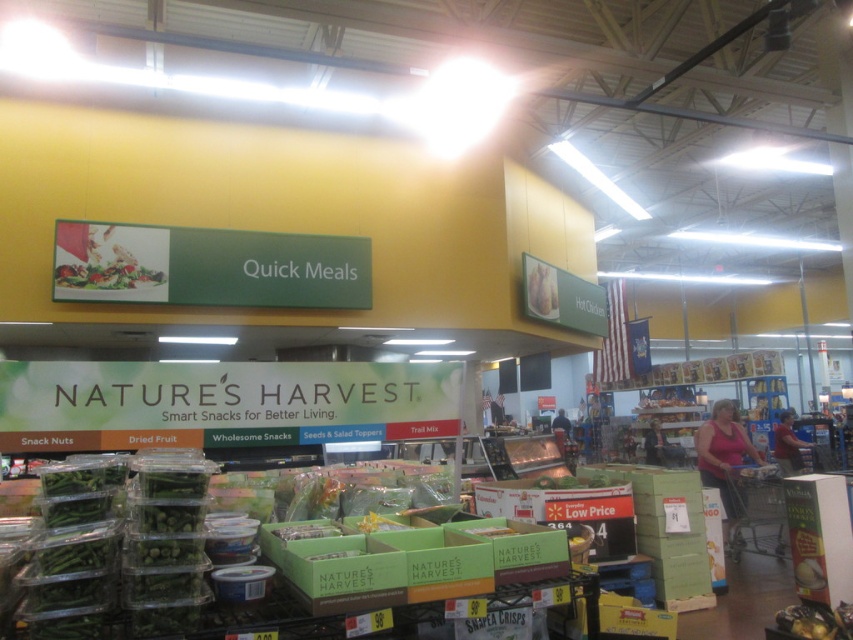
Question: Which point is farther from the camera taking this photo?

Choices:
 (A) (728, 436)
 (B) (97, 289)

Answer: (A)

Question: Does pink fabric shirt at lower right appear over matte plastic salad at upper center?

Choices:
 (A) yes
 (B) no

Answer: (B)

Question: Does pink fabric shirt at lower right come in front of matte plastic salad at upper center?

Choices:
 (A) yes
 (B) no

Answer: (B)

Question: Observing the image, what is the correct spatial positioning of pink fabric shirt at lower right in reference to matte plastic salad at upper center?

Choices:
 (A) left
 (B) right

Answer: (B)